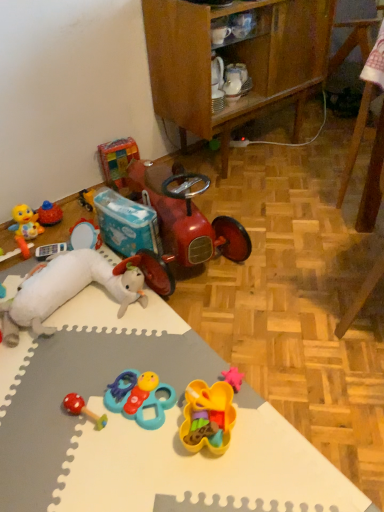
Find the location of `vacant area that lies between teal plastic toy at center, which is counted as the 3th toy, starting from the front, and white plush toy at lower left, the 2th toy from the top`. vacant area that lies between teal plastic toy at center, which is counted as the 3th toy, starting from the front, and white plush toy at lower left, the 2th toy from the top is located at coordinates (111, 353).